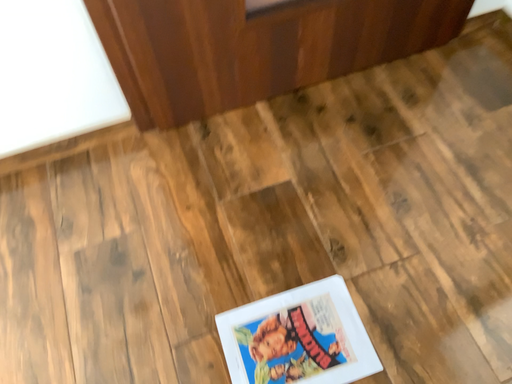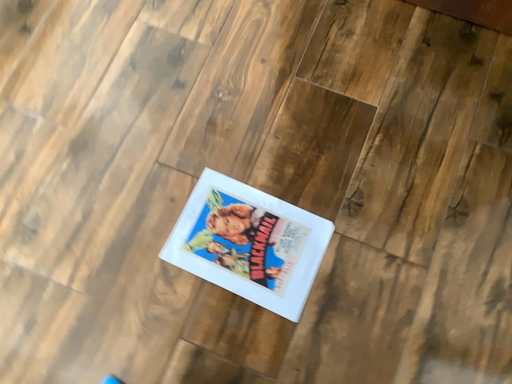
Question: Which way did the camera rotate in the video?

Choices:
 (A) rotated downward
 (B) rotated upward

Answer: (A)